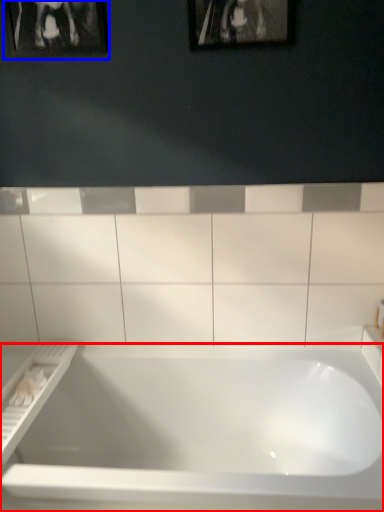
Question: Among these objects, which one is nearest to the camera, bathtub (highlighted by a red box) or picture frame (highlighted by a blue box)?

Choices:
 (A) bathtub
 (B) picture frame

Answer: (A)